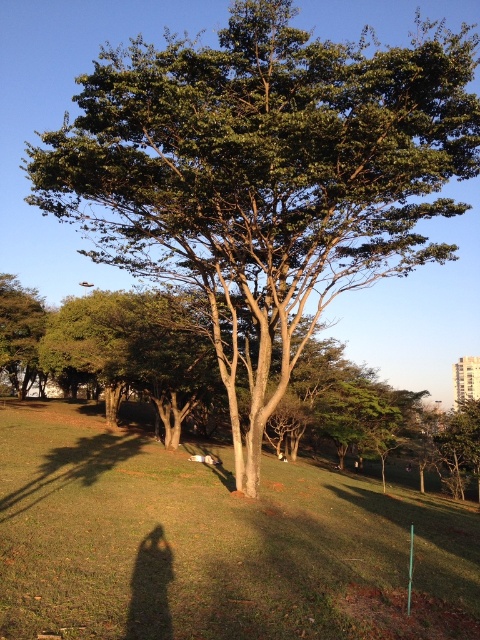
Question: Can you confirm if green grassy at center is thinner than green leafy tree at left?

Choices:
 (A) no
 (B) yes

Answer: (A)

Question: In this image, where is green grassy at center located relative to green leafy tree at left?

Choices:
 (A) right
 (B) left

Answer: (A)

Question: Which object appears farthest from the camera in this image?

Choices:
 (A) green leafy tree at left
 (B) green grassy at center

Answer: (A)

Question: Does green grassy at center come behind green leafy tree at left?

Choices:
 (A) yes
 (B) no

Answer: (B)

Question: Which object appears closest to the camera in this image?

Choices:
 (A) green leafy tree at left
 (B) green grassy at center

Answer: (B)